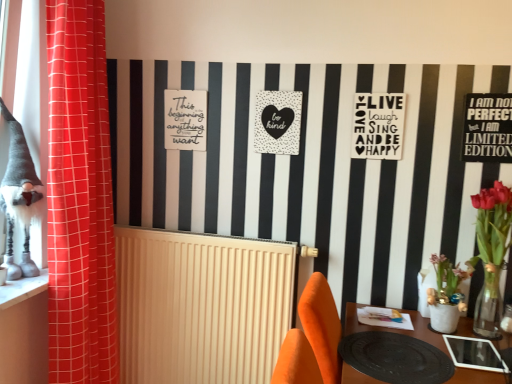
Question: Do you think gray fabric gnome at left is within white matte poster at upper center, positioned as the second postcard in right-to-left order, or outside of it?

Choices:
 (A) outside
 (B) inside

Answer: (A)

Question: Is gray fabric gnome at left in front of or behind white matte poster at upper center, which ranks as the 2th postcard in back-to-front order, in the image?

Choices:
 (A) behind
 (B) front

Answer: (B)

Question: Which of these objects is positioned farthest from the white matte poster at upper center, positioned as the second postcard in right-to-left order?

Choices:
 (A) white stone window sill at lower left
 (B) matte white sign at upper left
 (C) black dotted heart at center, the 1th postcard in the back-to-front sequence
 (D) white ribbed radiator at center
 (E) black matte table at lower right

Answer: (A)

Question: Which object is the closest to the white ribbed radiator at center?

Choices:
 (A) gray fabric gnome at left
 (B) black matte sign at upper right, the 1th postcard from the right
 (C) black matte table at lower right
 (D) black dotted heart at center, the 1th postcard in the back-to-front sequence
 (E) red fabric curtain at left

Answer: (E)